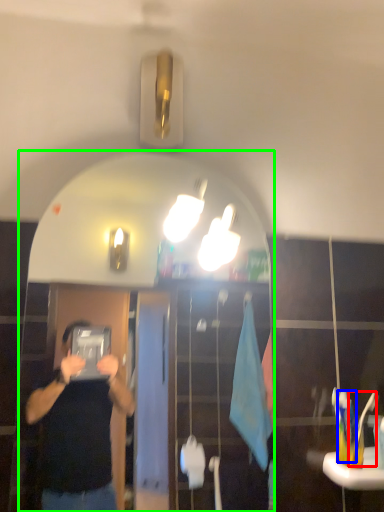
Question: Considering the real-world distances, which object is closest to toothbrush (highlighted by a red box)? toothbrush (highlighted by a blue box) or mirror (highlighted by a green box).

Choices:
 (A) toothbrush
 (B) mirror

Answer: (A)